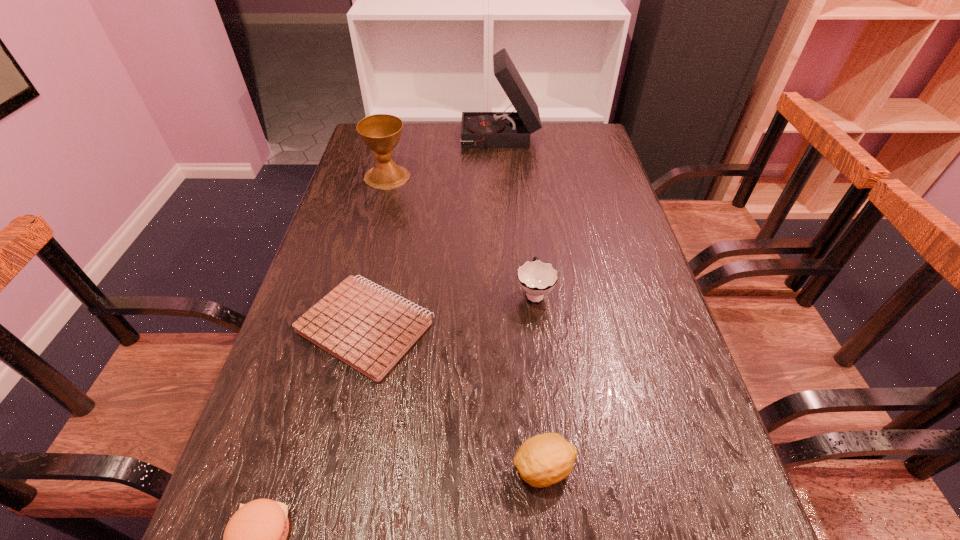
This screenshot has width=960, height=540. I want to click on vacant area between the fifth shortest object and the cup, so (461, 234).

Find the location of a particular element. This screenshot has height=540, width=960. empty space between the notebook and the farthest object is located at coordinates (433, 233).

Find the location of a particular element. The image size is (960, 540). object that can be found as the closest to the cup is located at coordinates (370, 330).

Find the location of a particular element. the third closest object to the fifth farthest object is located at coordinates (254, 539).